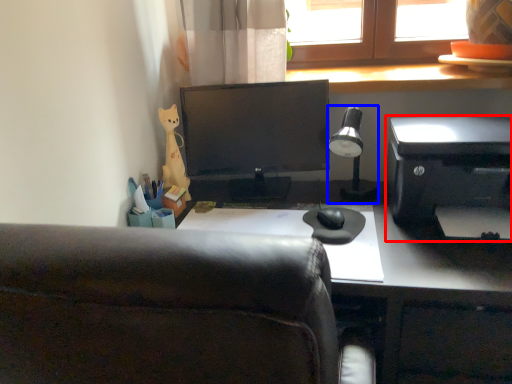
Question: Which of the following is the farthest to the observer, printer (highlighted by a red box) or lamp (highlighted by a blue box)?

Choices:
 (A) printer
 (B) lamp

Answer: (B)